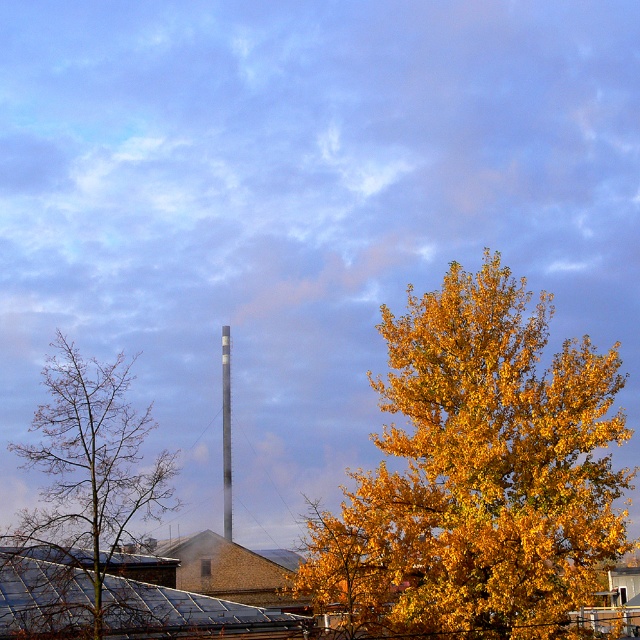
Which is more to the right, golden yellow leaves at center or bare branches at left?

golden yellow leaves at center is more to the right.

Can you confirm if golden yellow leaves at center is positioned to the left of bare branches at left?

No, golden yellow leaves at center is not to the left of bare branches at left.

Is point (616, 470) farther from camera compared to point (132, 467)?

That is True.

You are a GUI agent. You are given a task and a screenshot of the screen. Output one action in this format:
    pyautogui.click(x=<x>, y=<y>)
    Task: Click on the golden yellow leaves at center
    
    Given the screenshot: What is the action you would take?
    pyautogui.click(x=476, y=474)

From the picture: Who is lower down, golden yellow leaves at center or smooth gray chimney at center?

Positioned lower is smooth gray chimney at center.

Where is `golden yellow leaves at center`? The height and width of the screenshot is (640, 640). golden yellow leaves at center is located at coordinates (476, 474).

This screenshot has height=640, width=640. In order to click on golden yellow leaves at center in this screenshot , I will do `click(476, 474)`.

Does bare branches at left have a larger size compared to smooth gray chimney at center?

Yes, bare branches at left is bigger than smooth gray chimney at center.

Find the location of a particular element. bare branches at left is located at coordinates (90, 461).

Who is more distant from viewer, (x=60, y=547) or (x=225, y=349)?

Positioned behind is point (x=225, y=349).

Locate an element on the screen. The height and width of the screenshot is (640, 640). bare branches at left is located at coordinates (90, 461).